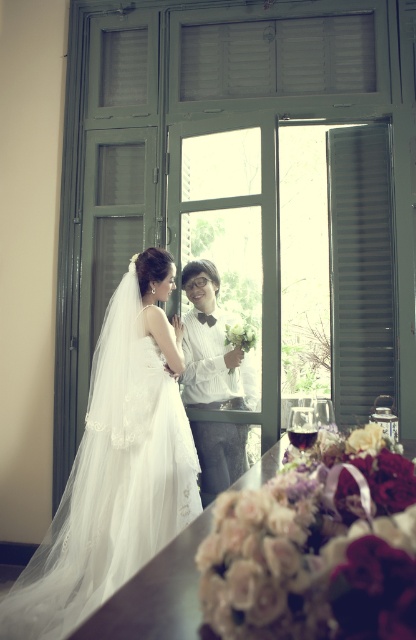
Who is higher up, black matte shutter at right or white textured shirt at center?

black matte shutter at right is higher up.

Is black matte shutter at right positioned before white textured shirt at center?

Yes, it is in front of white textured shirt at center.

Is point (364, 385) behind point (205, 420)?

No, (364, 385) is closer to viewer.

Identify the location of black matte shutter at right. (361, 269).

Who is taller, white lace dress at center or black matte shutter at right?

black matte shutter at right is taller.

Is white lace dress at center taller than black matte shutter at right?

Incorrect, white lace dress at center's height is not larger of black matte shutter at right's.

The width and height of the screenshot is (416, 640). What do you see at coordinates (111, 488) in the screenshot?
I see `white lace dress at center` at bounding box center [111, 488].

Find the location of a particular element. The image size is (416, 640). white lace dress at center is located at coordinates (111, 488).

In order to click on white lace dress at center in this screenshot , I will do `click(111, 488)`.

This screenshot has width=416, height=640. Describe the element at coordinates (111, 488) in the screenshot. I see `white lace dress at center` at that location.

What do you see at coordinates (111, 488) in the screenshot? The image size is (416, 640). I see `white lace dress at center` at bounding box center [111, 488].

Locate an element on the screen. The height and width of the screenshot is (640, 416). white lace dress at center is located at coordinates (111, 488).